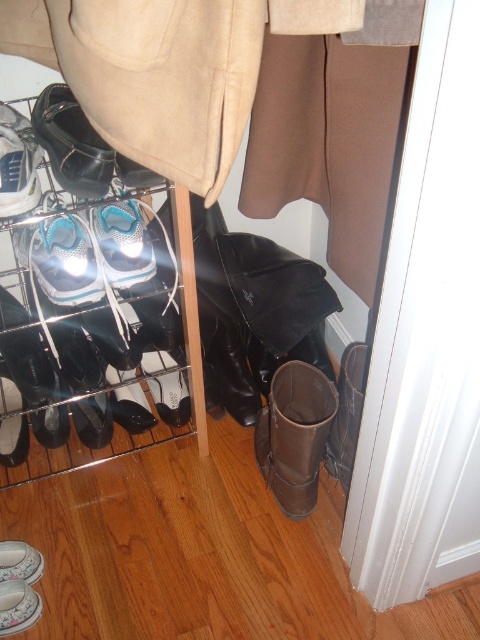
You are organizing a closet and need to place a new shoe exactly at point (167,387). Which existing shoe in the scene is already occupying that exact location?

The white suede shoe at center is located at point (167,387).

You are organizing your closet and see the white suede shoe at center and the white leather shoe at lower left. Which shoe is positioned to the right side of the other?

The white suede shoe at center is positioned to the right of the white leather shoe at lower left.

You are organizing your closet and need to place a new pair of white shoes. You see the white suede shoe at center and the white rubber shoe at lower left. Which one is positioned higher in the closet?

The white suede shoe at center is positioned higher than the white rubber shoe at lower left.